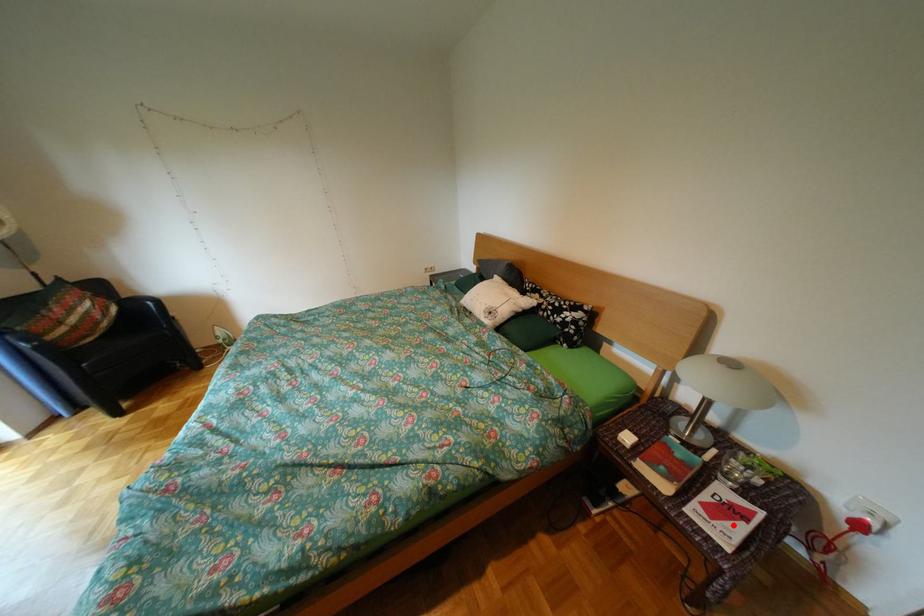
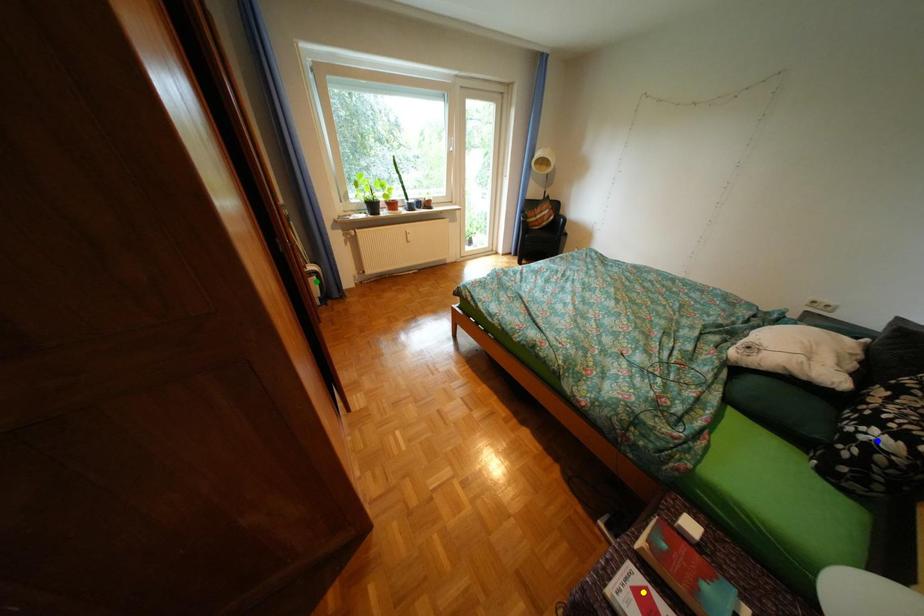
Question: I am providing you with two images of the same scene from different viewpoints. A red point is marked on the first image. You are given multiple points on the second image. Which point in image 2 is actually the same real-world point as the red point in image 1?

Choices:
 (A) green point
 (B) blue point
 (C) yellow point

Answer: (C)